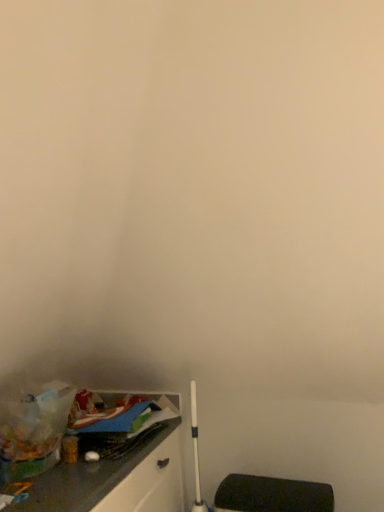
Locate an element on the screen. This screenshot has width=384, height=512. black rubberized mat at lower right is located at coordinates (272, 495).

Image resolution: width=384 pixels, height=512 pixels. What do you see at coordinates (272, 495) in the screenshot?
I see `black rubberized mat at lower right` at bounding box center [272, 495].

Locate an element on the screen. The height and width of the screenshot is (512, 384). black rubberized mat at lower right is located at coordinates (272, 495).